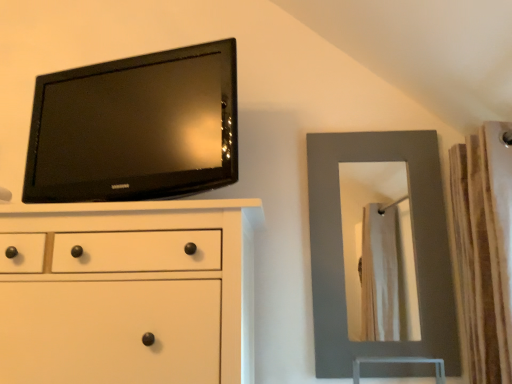
Question: From the image's perspective, is black glossy tv at upper left under matte white chest of drawers at upper left?

Choices:
 (A) no
 (B) yes

Answer: (A)

Question: Is black glossy tv at upper left in contact with matte white chest of drawers at upper left?

Choices:
 (A) no
 (B) yes

Answer: (A)

Question: From a real-world perspective, is black glossy tv at upper left over matte white chest of drawers at upper left?

Choices:
 (A) no
 (B) yes

Answer: (B)

Question: From a real-world perspective, is black glossy tv at upper left physically below matte white chest of drawers at upper left?

Choices:
 (A) no
 (B) yes

Answer: (A)

Question: Can you confirm if black glossy tv at upper left is taller than matte white chest of drawers at upper left?

Choices:
 (A) yes
 (B) no

Answer: (B)

Question: Is black glossy tv at upper left looking in the opposite direction of matte white chest of drawers at upper left?

Choices:
 (A) no
 (B) yes

Answer: (A)

Question: Can black glossy tv at upper left be found inside brown textured curtain at right?

Choices:
 (A) no
 (B) yes

Answer: (A)

Question: Could you tell me if brown textured curtain at right is facing black glossy tv at upper left?

Choices:
 (A) yes
 (B) no

Answer: (A)

Question: Considering the relative sizes of brown textured curtain at right and black glossy tv at upper left in the image provided, is brown textured curtain at right bigger than black glossy tv at upper left?

Choices:
 (A) yes
 (B) no

Answer: (A)

Question: Is brown textured curtain at right facing away from black glossy tv at upper left?

Choices:
 (A) no
 (B) yes

Answer: (A)

Question: Is brown textured curtain at right completely or partially outside of black glossy tv at upper left?

Choices:
 (A) yes
 (B) no

Answer: (A)

Question: Does brown textured curtain at right come in front of black glossy tv at upper left?

Choices:
 (A) no
 (B) yes

Answer: (B)

Question: Can you confirm if matte gray mirror at right is wider than brown textured curtain at right?

Choices:
 (A) no
 (B) yes

Answer: (A)